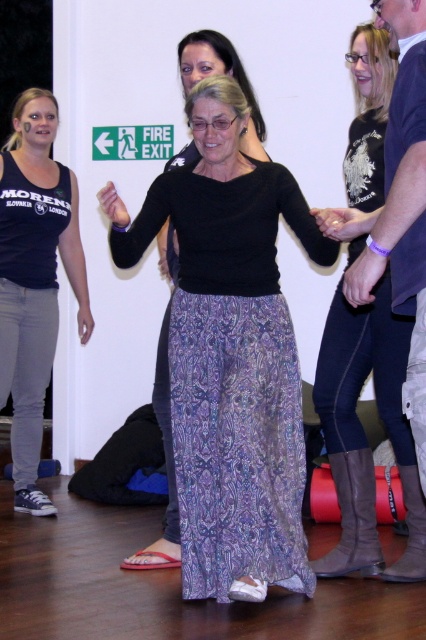
Does patterned fabric skirt at center have a lesser width compared to matte black tank top at left?

Yes.

This screenshot has width=426, height=640. In order to click on patterned fabric skirt at center in this screenshot , I will do `click(365, 433)`.

Which of these two, patterned fabric skirt at center or purple printed skirt at center, stands shorter?

purple printed skirt at center

Does patterned fabric skirt at center have a larger size compared to purple printed skirt at center?

Indeed, patterned fabric skirt at center has a larger size compared to purple printed skirt at center.

Find the location of a particular element. The image size is (426, 640). patterned fabric skirt at center is located at coordinates (365, 433).

Which of these two, matte black tank top at left or purple printed skirt at center, stands taller?

matte black tank top at left

Can you confirm if matte black tank top at left is wider than purple printed skirt at center?

Yes, matte black tank top at left is wider than purple printed skirt at center.

Where is `matte black tank top at left`? matte black tank top at left is located at coordinates (34, 280).